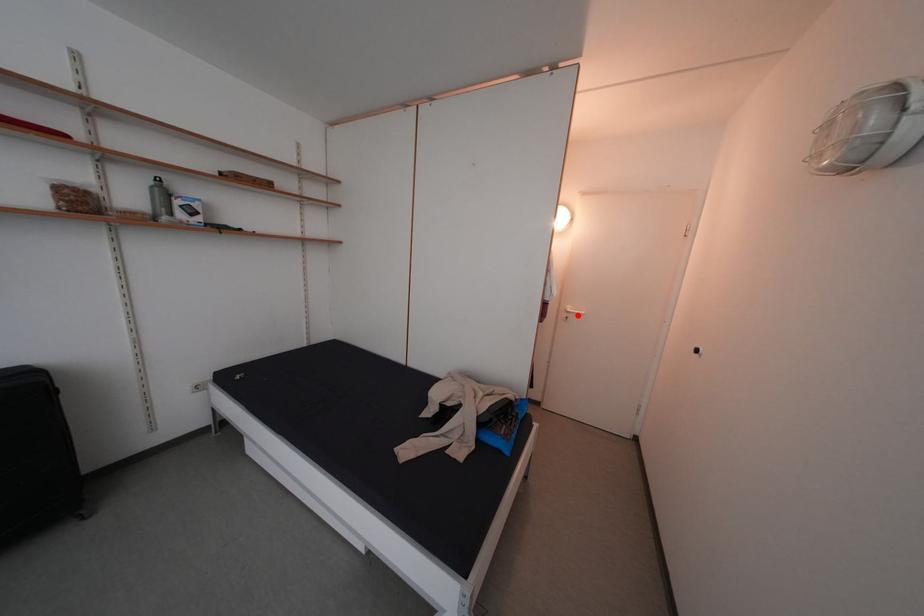
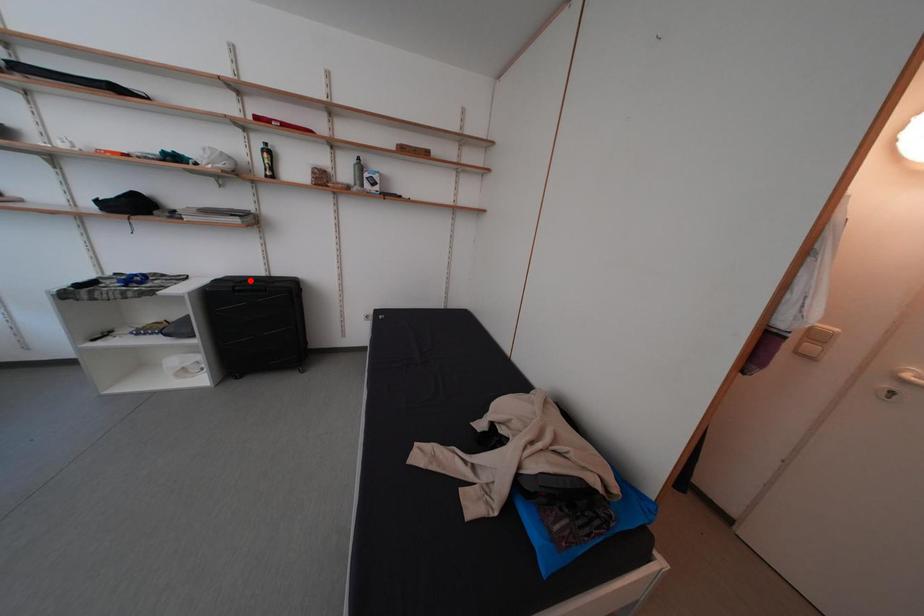
I am providing you with two images of the same scene from different viewpoints. A red point is marked on the first image and another point is marked on the second image. Does the point marked in image1 correspond to the same location as the one in image2?

No